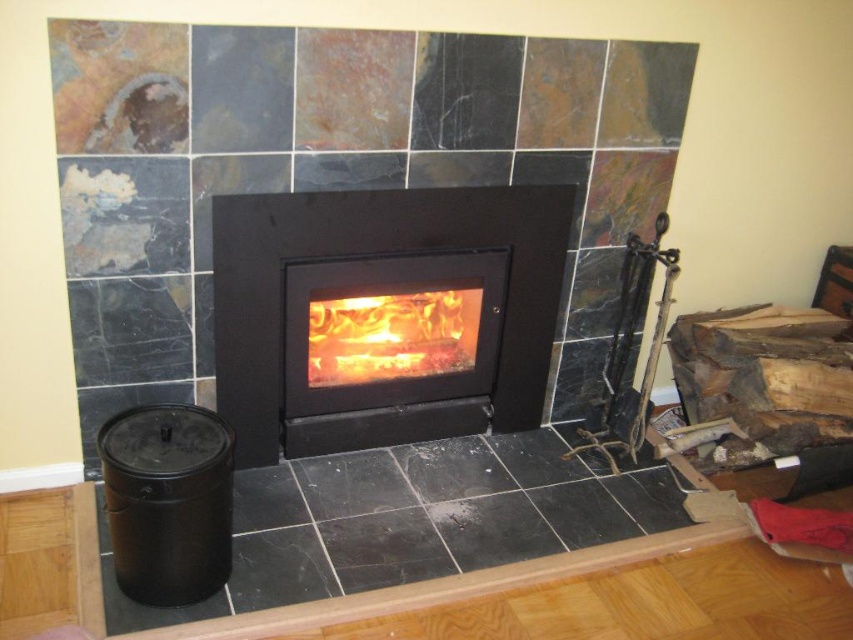
Question: Which of the following is the closest to the observer?

Choices:
 (A) (328, 385)
 (B) (318, 394)

Answer: (B)

Question: Does black matte fireplace at center appear on the left side of flamewoodfireplace at center?

Choices:
 (A) yes
 (B) no

Answer: (B)

Question: Is black matte fireplace at center positioned before flamewoodfireplace at center?

Choices:
 (A) yes
 (B) no

Answer: (A)

Question: Can you confirm if black matte fireplace at center is positioned above flamewoodfireplace at center?

Choices:
 (A) yes
 (B) no

Answer: (A)